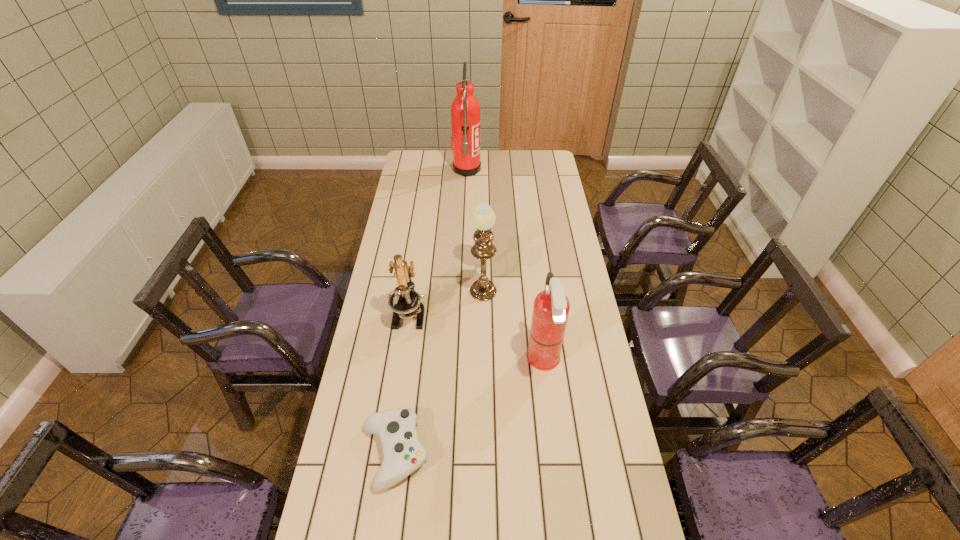
Locate an element on the screen. The width and height of the screenshot is (960, 540). vacant point at the left edge is located at coordinates (399, 381).

The image size is (960, 540). What are the coordinates of `vacant space at the right edge` in the screenshot? It's located at (575, 267).

Locate an element on the screen. The height and width of the screenshot is (540, 960). vacant space in between the nearest object and the microscope is located at coordinates (402, 384).

You are a GUI agent. You are given a task and a screenshot of the screen. Output one action in this format:
    pyautogui.click(x=<x>, y=<y>)
    Task: Click on the vacant space that's between the fourth farthest object and the oil lamp
    
    Given the screenshot: What is the action you would take?
    pyautogui.click(x=514, y=321)

The width and height of the screenshot is (960, 540). Find the location of `vacant point located between the farthest object and the microscope`. vacant point located between the farthest object and the microscope is located at coordinates (438, 242).

Find the location of a particular element. The height and width of the screenshot is (540, 960). free space between the shortest object and the microscope is located at coordinates (402, 384).

Find the location of a particular element. This screenshot has width=960, height=540. free point between the shorter fire extinguisher and the microscope is located at coordinates (476, 337).

In order to click on empty space between the farthest object and the microscope in this screenshot , I will do `click(438, 242)`.

This screenshot has width=960, height=540. Identify the location of empty location between the oil lamp and the control. (439, 367).

Where is `vacant space that's between the microscope and the shorter fire extinguisher`? Image resolution: width=960 pixels, height=540 pixels. vacant space that's between the microscope and the shorter fire extinguisher is located at coordinates (476, 337).